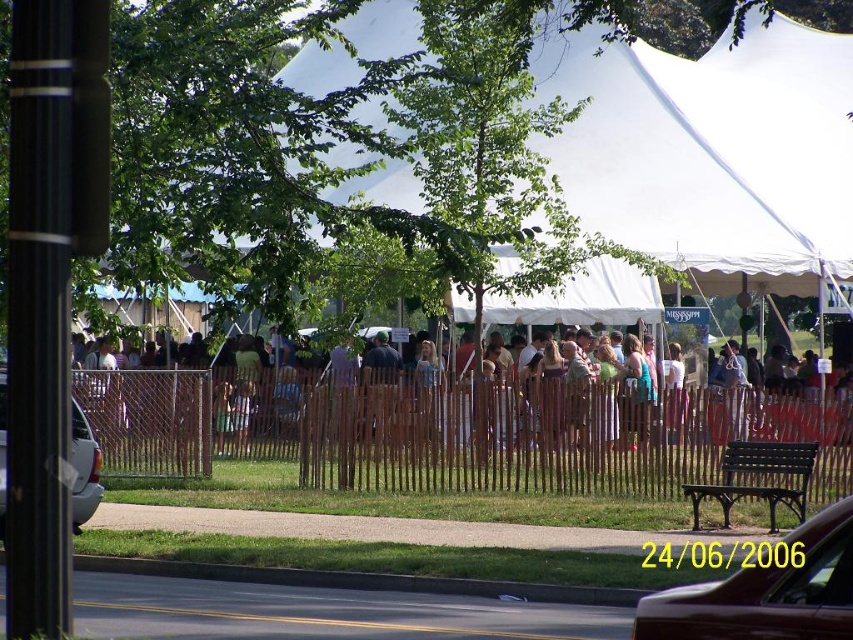
You are a delivery person with a 3.5 meter long truck. You need to park your truck between the brown wooden fence at center and the white matte car at left. Is there enough space to park your truck without touching either the fence or the car?

The brown wooden fence at center and white matte car at left are 5.00 meters apart from each other. Since your truck is 3.5 meters long, there is enough space to park between them without touching either object.

You are standing at the point labeled as point (x=757, y=481) and want to sit down. Is there a bench nearby where you can rest?

Yes, the point (x=757, y=481) is located on the green wooden bench at lower right, so you can sit there.